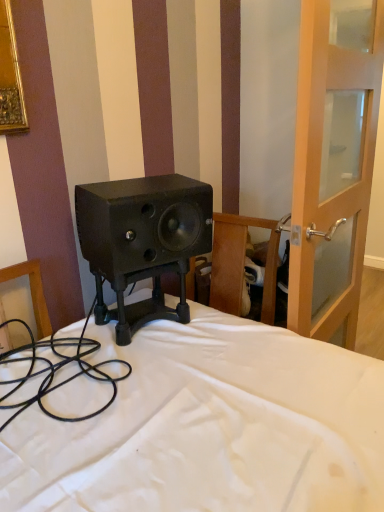
The height and width of the screenshot is (512, 384). What are the coordinates of `free space above black matte speaker at center (from a real-world perspective)` in the screenshot? It's located at (x=144, y=182).